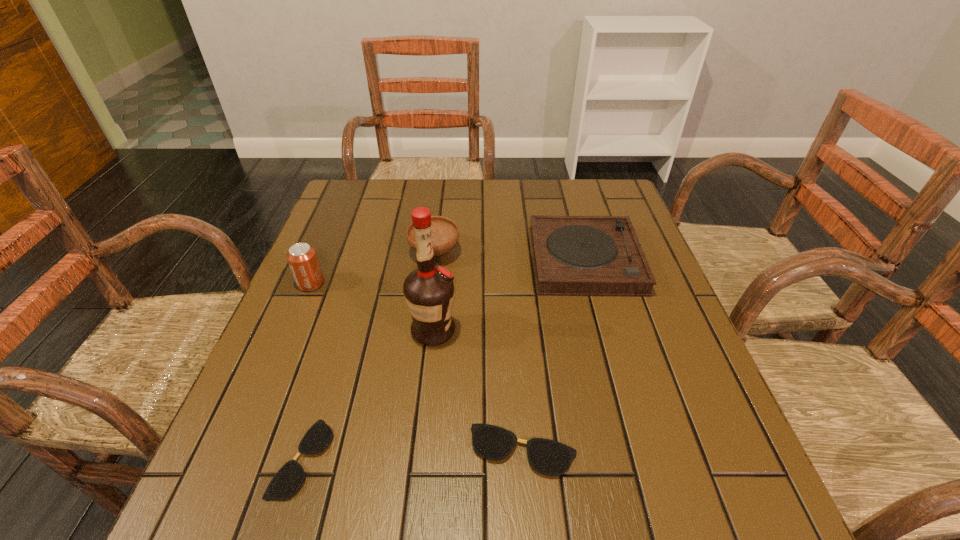
Identify the location of vacant space located 0.360m on the back of the shortest object. This screenshot has width=960, height=540. (355, 286).

I want to click on vacant space located 0.310m on the left of the taller spectacles, so click(x=291, y=450).

What are the coordinates of `blank space located on the right of the third tallest object` in the screenshot? It's located at (547, 252).

This screenshot has height=540, width=960. Find the location of `vacant space located on the left of the third shortest object`. vacant space located on the left of the third shortest object is located at coordinates (432, 260).

At what (x,y) coordinates should I click in order to perform the action: click on free space located on the front and back of the fourth farthest object. Please return your answer as a coordinate pair (x, y). This screenshot has height=540, width=960. Looking at the image, I should click on (562, 331).

The height and width of the screenshot is (540, 960). Find the location of `vacant space located 0.250m on the right of the second tallest object`. vacant space located 0.250m on the right of the second tallest object is located at coordinates (426, 284).

At what (x,y) coordinates should I click in order to perform the action: click on spectacles that is positioned at the left edge. Please return your answer as a coordinate pair (x, y). The width and height of the screenshot is (960, 540). Looking at the image, I should click on (286, 482).

Identify the location of can that is at the left edge. This screenshot has height=540, width=960. (302, 258).

The image size is (960, 540). I want to click on object positioned at the right edge, so click(572, 255).

Where is `object that is at the near left corner`? The width and height of the screenshot is (960, 540). object that is at the near left corner is located at coordinates (286, 482).